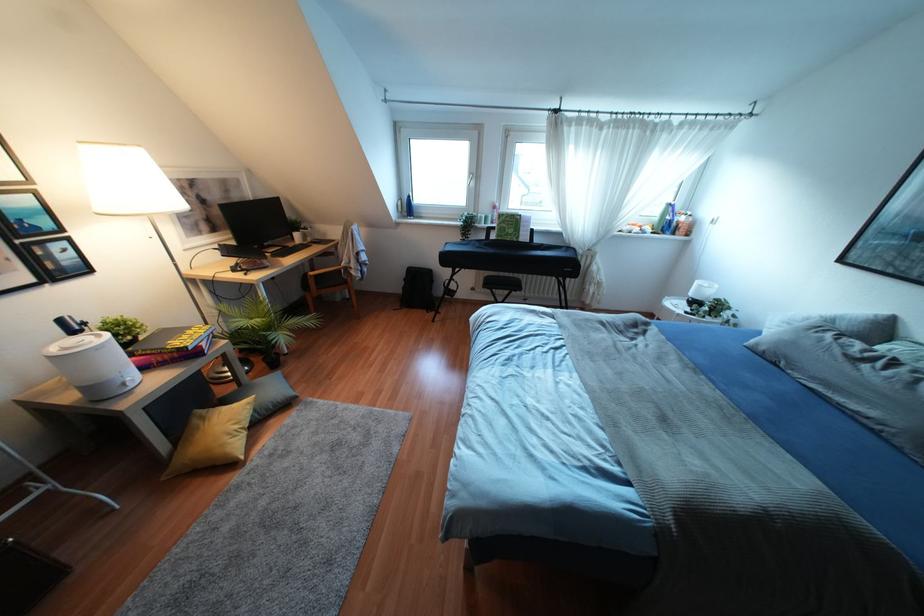
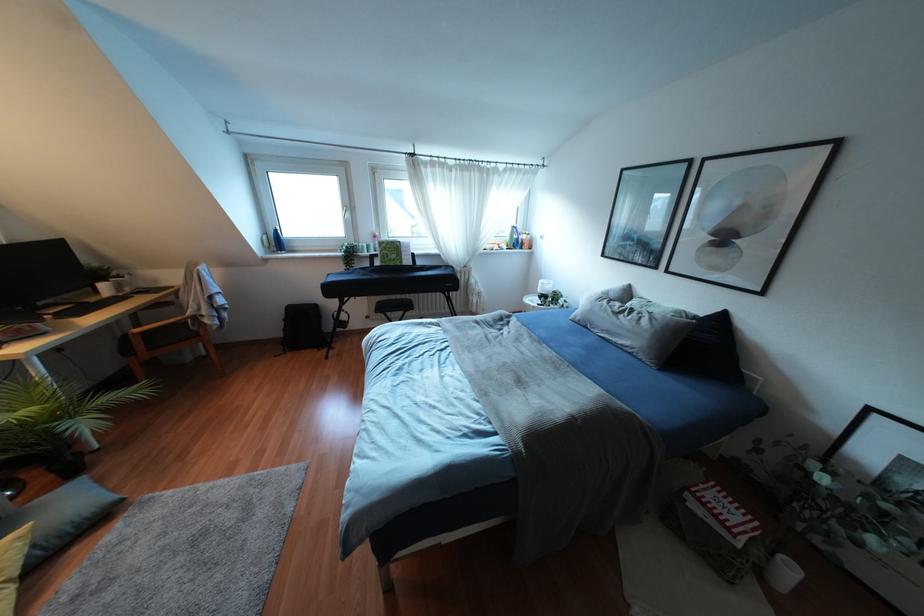
Find the pixel in the second image that matches point (864, 366) in the first image.

(619, 315)